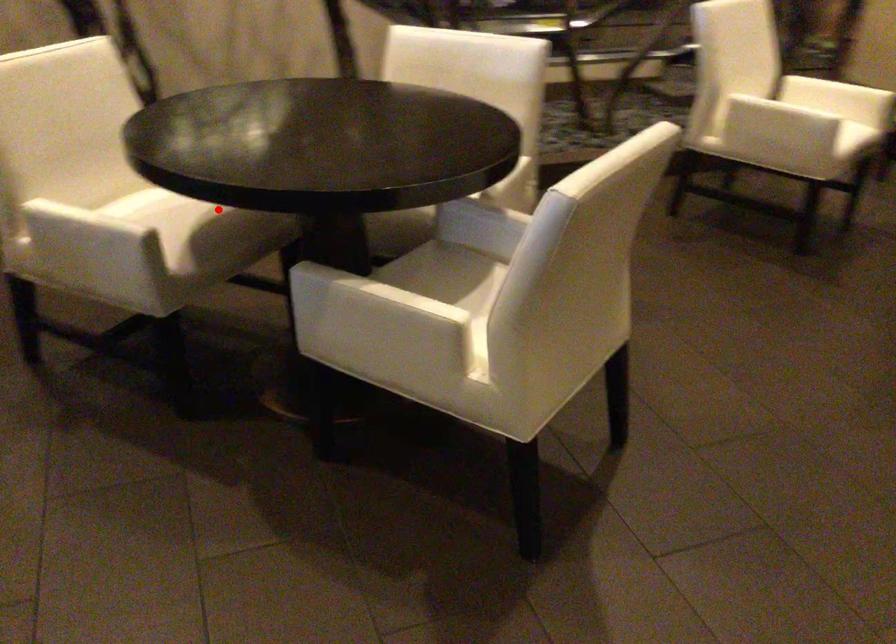
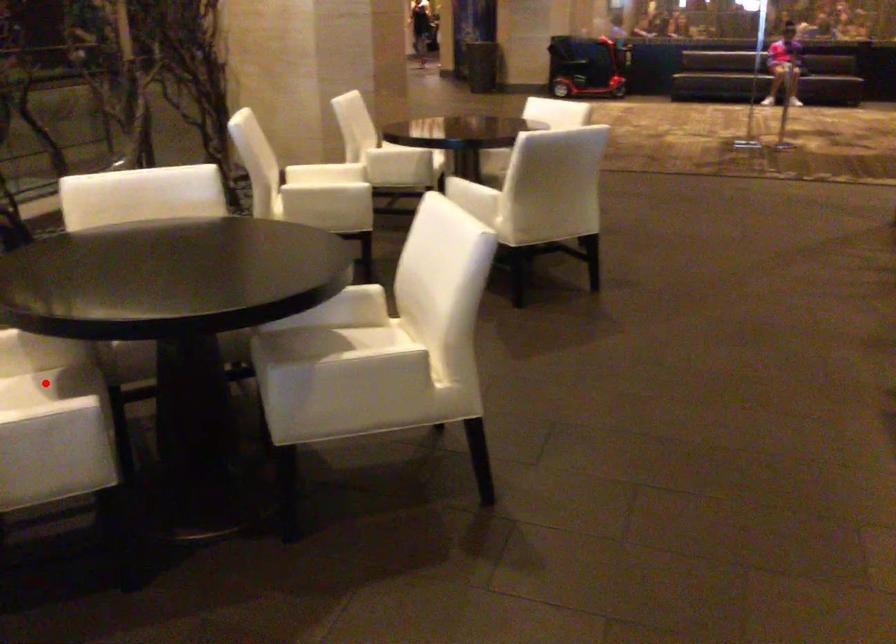
I am providing you with two images of the same scene from different viewpoints. A red point is marked on the first image and another point is marked on the second image. Is the red point in image1 aligned with the point shown in image2?

Yes